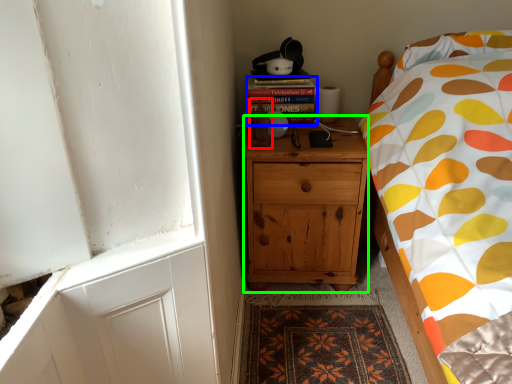
Question: Which is farther away from toy (highlighted by a red box)? book (highlighted by a blue box) or cabinetry (highlighted by a green box)?

Choices:
 (A) book
 (B) cabinetry

Answer: (B)